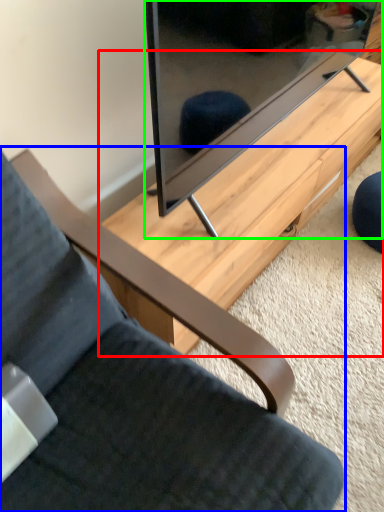
Question: Which object is positioned closest to table (highlighted by a red box)? Select from chair (highlighted by a blue box) and television (highlighted by a green box).

Choices:
 (A) chair
 (B) television

Answer: (B)